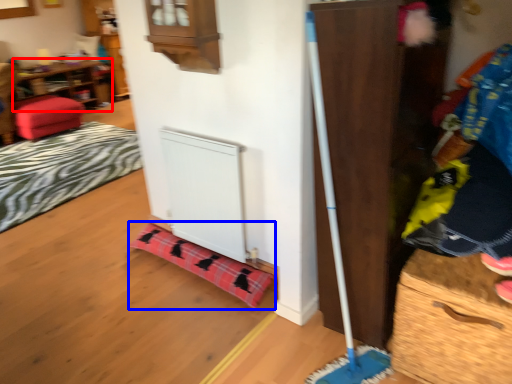
Question: Among these objects, which one is farthest to the camera, shelf (highlighted by a red box) or blanket (highlighted by a blue box)?

Choices:
 (A) shelf
 (B) blanket

Answer: (A)